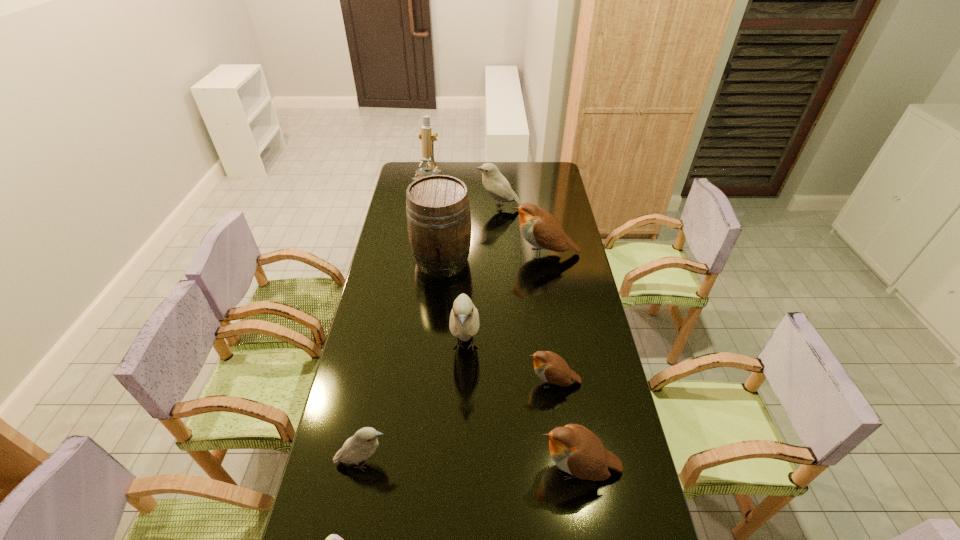
In order to click on cider positioned at the left edge in this screenshot , I will do `click(438, 214)`.

Locate an element on the screen. This screenshot has height=540, width=960. bird present at the left edge is located at coordinates (364, 443).

Where is `vacant space at the far edge of the desktop`? vacant space at the far edge of the desktop is located at coordinates (472, 163).

In the image, there is a desktop. Identify the location of vacant space at the left edge. This screenshot has width=960, height=540. (391, 291).

Locate an element on the screen. vacant point at the right edge is located at coordinates (548, 210).

In the image, there is a desktop. Where is `vacant space at the far left corner`? The image size is (960, 540). vacant space at the far left corner is located at coordinates (407, 165).

Where is `vacant space at the far right corner`? This screenshot has width=960, height=540. vacant space at the far right corner is located at coordinates (552, 167).

Find the location of a particular element. This screenshot has height=540, width=960. free point between the smallest brown bird and the farthest bird is located at coordinates (526, 295).

Find the location of `blank region between the third tallest object and the smallest white bird`. blank region between the third tallest object and the smallest white bird is located at coordinates (415, 405).

What are the coordinates of `blank region between the farthest brown bird and the second farthest white bird` in the screenshot? It's located at (505, 300).